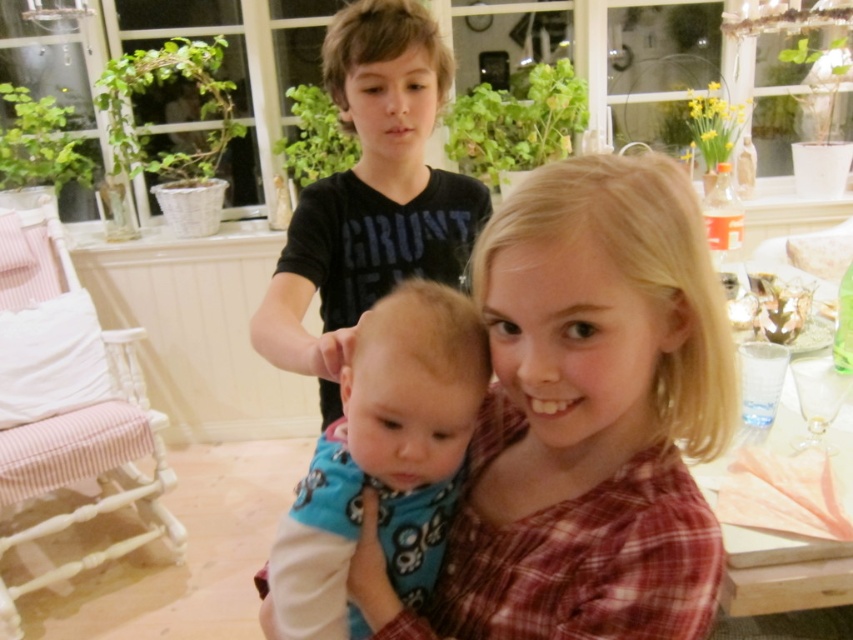
Is plaid fabric shirt at center thinner than black matte shirt at upper center?

Indeed, plaid fabric shirt at center has a lesser width compared to black matte shirt at upper center.

In order to click on plaid fabric shirt at center in this screenshot , I will do `click(585, 419)`.

The image size is (853, 640). I want to click on plaid fabric shirt at center, so click(585, 419).

You are a GUI agent. You are given a task and a screenshot of the screen. Output one action in this format:
    pyautogui.click(x=<x>, y=<y>)
    Task: Click on the plaid fabric shirt at center
    The width and height of the screenshot is (853, 640).
    Given the screenshot: What is the action you would take?
    pyautogui.click(x=585, y=419)

Is point (689, 285) closer to viewer compared to point (393, 536)?

That is True.

What do you see at coordinates (585, 419) in the screenshot? I see `plaid fabric shirt at center` at bounding box center [585, 419].

Find the location of `plaid fabric shirt at center`. plaid fabric shirt at center is located at coordinates (585, 419).

Who is higher up, black matte shirt at upper center or blue fabric baby at center?

black matte shirt at upper center is above.

Between black matte shirt at upper center and blue fabric baby at center, which one has more height?

black matte shirt at upper center is taller.

Is point (281, 346) positioned in front of point (430, 560)?

No, it is not.

Image resolution: width=853 pixels, height=640 pixels. What are the coordinates of `black matte shirt at upper center` in the screenshot? It's located at (370, 193).